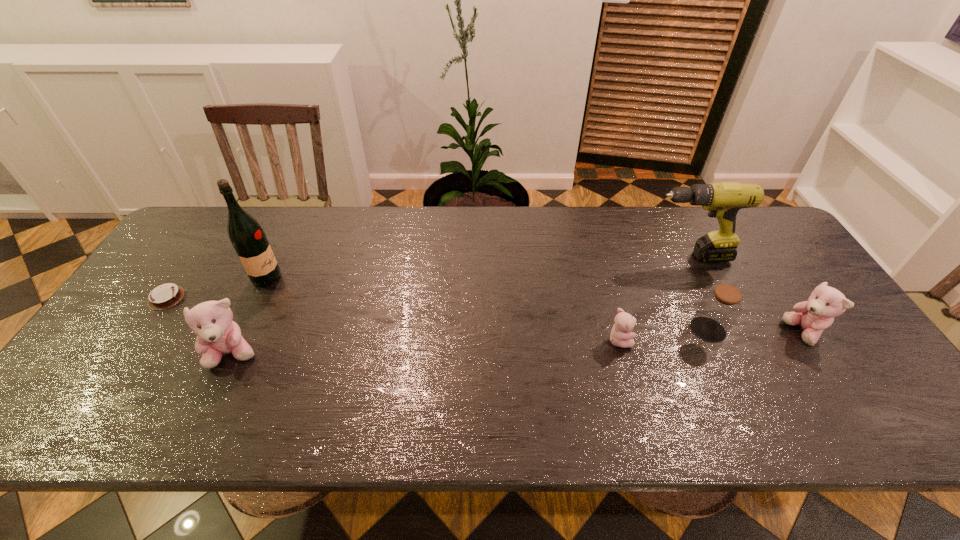
Identify the location of the leftmost teddy bear. (217, 335).

Locate an element on the screen. the second shortest object is located at coordinates coord(621,336).

At what (x,y) coordinates should I click in order to perform the action: click on the second teddy bear from left to right. Please return your answer as a coordinate pair (x, y). The height and width of the screenshot is (540, 960). Looking at the image, I should click on (621, 336).

Where is `the rightmost teddy bear`? The width and height of the screenshot is (960, 540). the rightmost teddy bear is located at coordinates [813, 316].

Identify the location of the second tallest teddy bear. The height and width of the screenshot is (540, 960). (813, 316).

This screenshot has width=960, height=540. Find the location of `the tallest object`. the tallest object is located at coordinates (x=245, y=233).

You are a GUI agent. You are given a task and a screenshot of the screen. Output one action in this format:
    pyautogui.click(x=<x>, y=<y>)
    Task: Click on the drill
    The height and width of the screenshot is (540, 960).
    Given the screenshot: What is the action you would take?
    pyautogui.click(x=723, y=200)

Where is `the second tallest object`? Image resolution: width=960 pixels, height=540 pixels. the second tallest object is located at coordinates (723, 200).

Locate an element on the screen. Image resolution: width=960 pixels, height=540 pixels. the leftmost object is located at coordinates (167, 295).

Find the location of a particular element. This screenshot has height=540, width=960. the shortest object is located at coordinates (167, 295).